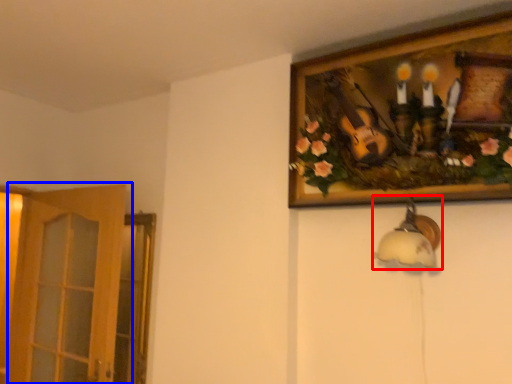
Question: Which object is further to the camera taking this photo, lamp (highlighted by a red box) or door (highlighted by a blue box)?

Choices:
 (A) lamp
 (B) door

Answer: (B)